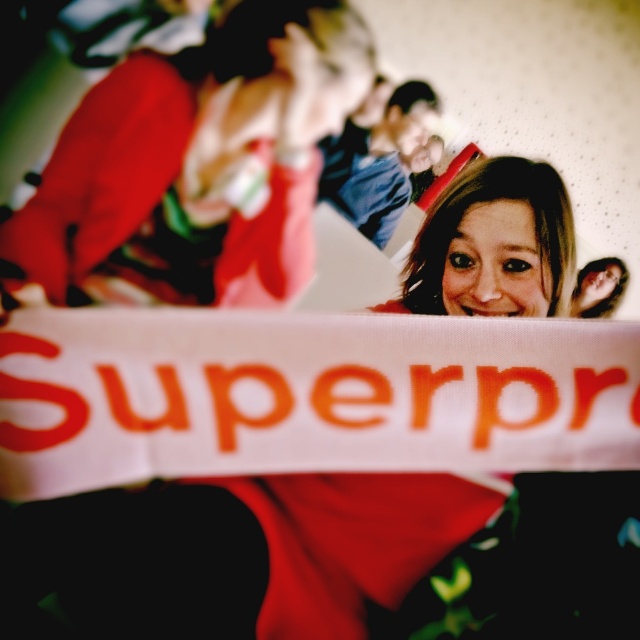
You are a photographer trying to capture a clear shot of the banner text. The banner is held at point (326, 461). If your camera has a minimum focus distance of 16 inches, will you be able to focus on the banner?

The distance between the camera and point (326, 461) is 16.35 inches, which is slightly more than the camera minimum focus distance of 16 inches. Therefore, the camera can focus on the banner.

You are a photographer at a social event and need to capture a photo of the white fabric sign at center and the matte red hoodie at upper left in the same frame. The camera you are using has a minimum focus distance of 15 inches. Can you take the photo without moving either object?

The distance between the white fabric sign at center and the matte red hoodie at upper left is 16.01 inches, which is greater than the camera minimum focus distance of 15 inches. Therefore, you can take the photo without moving either object.

You are at a social event and want to take a photo of the matte red hoodie at upper left and the white fabric sign at center. Which object should you focus on first if you want to capture both in the same frame without moving the camera?

The white fabric sign at center is positioned on the right side of matte red hoodie at upper left, so you should focus on the matte red hoodie at upper left first to ensure both are in the frame without moving the camera.